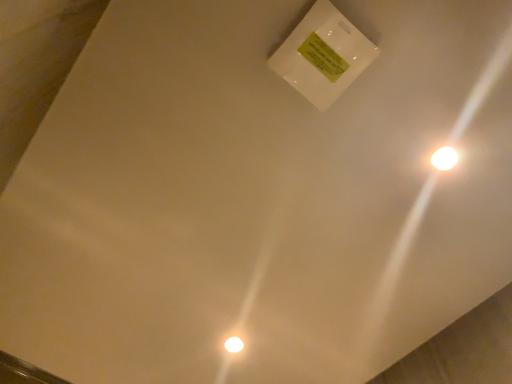
At what (x,y) coordinates should I click in order to perform the action: click on free space behind white glossy light at upper right. Please return your answer as a coordinate pair (x, y). This screenshot has width=512, height=384. Looking at the image, I should click on (429, 215).